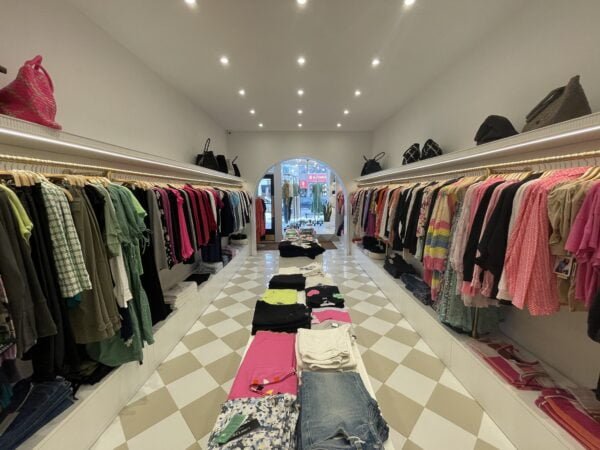
Identify the location of flooring. This screenshot has height=450, width=600. (178, 315), (223, 335).